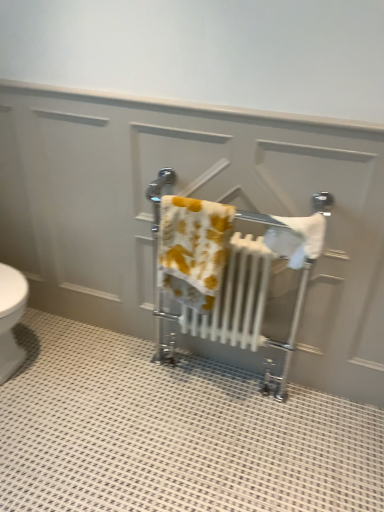
Identify the location of vacant space underneath yellow printed towel at center, the 1th bath towel positioned from the left (from a real-world perspective). (184, 392).